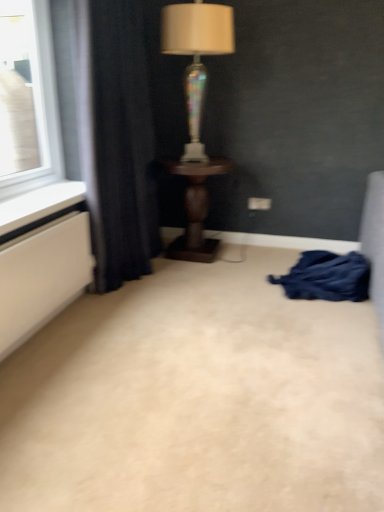
Question: Does point (120, 82) appear closer or farther from the camera than point (185, 238)?

Choices:
 (A) farther
 (B) closer

Answer: (B)

Question: Looking at their shapes, would you say dark blue fabric at left is wider or thinner than dark wood table at center?

Choices:
 (A) thin
 (B) wide

Answer: (A)

Question: Which object is the farthest from the iridescent glass lamp at center?

Choices:
 (A) dark blue fabric at lower right
 (B) beige carpet at center
 (C) dark blue fabric at left
 (D) dark wood table at center

Answer: (B)

Question: Estimate the real-world distances between objects in this image. Which object is farther from the beige carpet at center?

Choices:
 (A) dark wood table at center
 (B) dark blue fabric at left
 (C) dark blue fabric at lower right
 (D) iridescent glass lamp at center

Answer: (D)